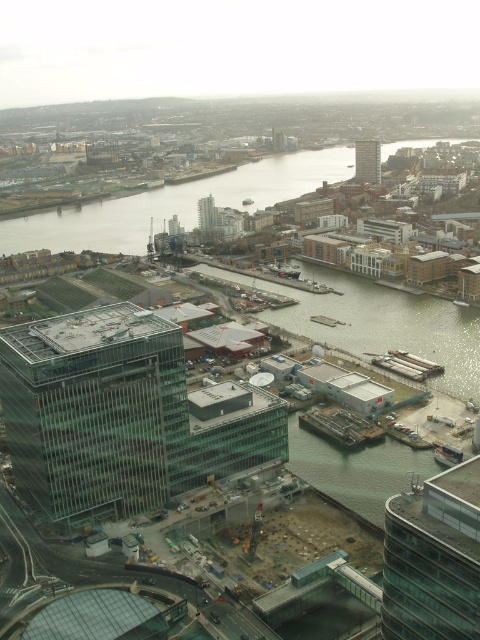
Question: Observing the image, what is the correct spatial positioning of transparent glass building at center in reference to clear water at center?

Choices:
 (A) left
 (B) right

Answer: (A)

Question: Among these objects, which one is nearest to the camera?

Choices:
 (A) green concrete waterway at center
 (B) transparent glass building at center
 (C) glassy concrete building at center
 (D) glassy concrete building at upper right

Answer: (B)

Question: Is glassy concrete building at upper right closer to camera compared to glassy concrete building at center?

Choices:
 (A) yes
 (B) no

Answer: (B)

Question: Which of the following is the closest to the observer?

Choices:
 (A) green concrete waterway at center
 (B) glassy concrete building at center
 (C) transparent glass building at center

Answer: (C)

Question: Does clear water at center appear on the right side of glassy concrete building at center?

Choices:
 (A) no
 (B) yes

Answer: (B)

Question: Estimate the real-world distances between objects in this image. Which object is farther from the clear water at center?

Choices:
 (A) glassy concrete building at upper right
 (B) transparent glass building at center

Answer: (B)